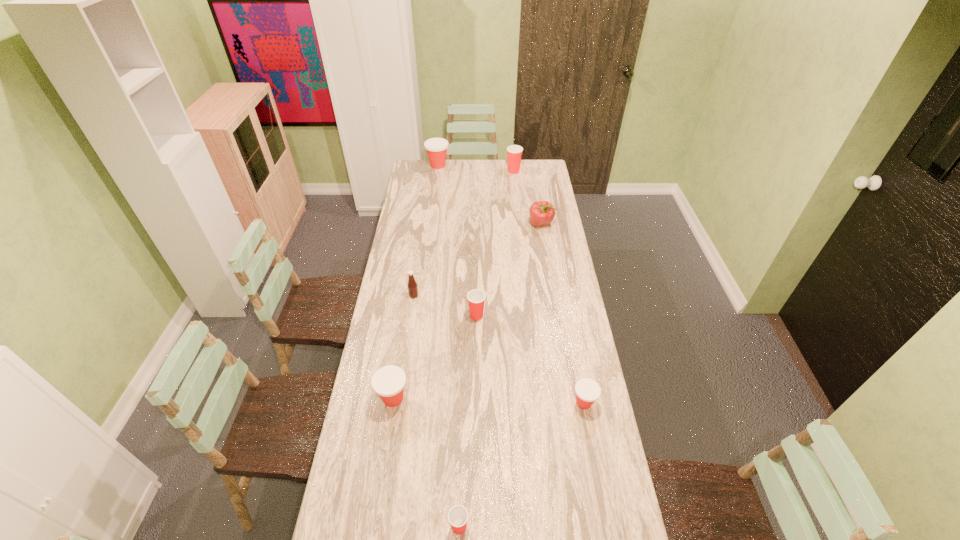
The height and width of the screenshot is (540, 960). I want to click on free space between the fifth nearest object and the biggest red-orange Dixie cup, so click(426, 231).

Where is `blank region between the rightmost red-orange Dixie cup and the biggest red-orange Dixie cup`? Image resolution: width=960 pixels, height=540 pixels. blank region between the rightmost red-orange Dixie cup and the biggest red-orange Dixie cup is located at coordinates (511, 284).

The height and width of the screenshot is (540, 960). I want to click on free space between the rightmost Dixie cup and the pink bell pepper, so click(x=563, y=313).

The height and width of the screenshot is (540, 960). I want to click on vacant space in between the third farthest object and the rightmost red-orange Dixie cup, so click(x=563, y=313).

At what (x,y) coordinates should I click in order to perform the action: click on blank region between the bell pepper and the smallest red Dixie cup. Please return your answer as a coordinate pair (x, y). Image resolution: width=960 pixels, height=540 pixels. Looking at the image, I should click on (500, 375).

At what (x,y) coordinates should I click in order to perform the action: click on free point between the nearest Dixie cup and the fifth nearest object. Please return your answer as a coordinate pair (x, y). The width and height of the screenshot is (960, 540). Looking at the image, I should click on (437, 411).

Locate an element on the screen. This screenshot has width=960, height=540. object that can be found as the third closest to the biggest red Dixie cup is located at coordinates (412, 285).

Where is `object that stands as the second closest to the nearest red Dixie cup`? object that stands as the second closest to the nearest red Dixie cup is located at coordinates (587, 391).

Image resolution: width=960 pixels, height=540 pixels. In order to click on the second closest Dixie cup to the rightmost red-orange Dixie cup in this screenshot , I will do `click(458, 515)`.

Where is `Dixie cup that is the fifth closest one to the rightmost red-orange Dixie cup`? Dixie cup that is the fifth closest one to the rightmost red-orange Dixie cup is located at coordinates tap(436, 148).